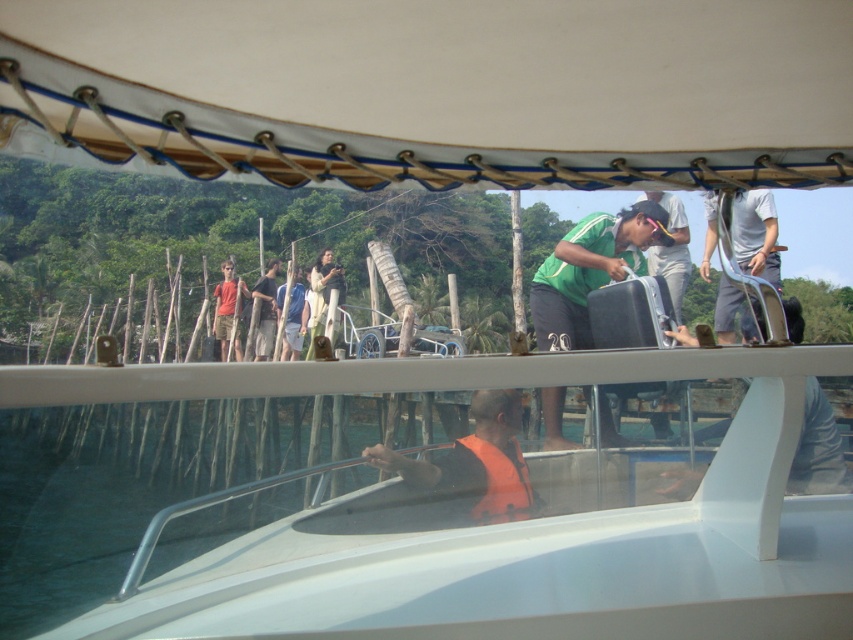
You are a tour guide on the boat and need to locate two tourists wearing green shirts. The first is wearing a green fabric shirt at center and the second a green matte shirt at upper center. Which tourist is positioned more to the right?

The green matte shirt at upper center is positioned more to the right than the green fabric shirt at center.

You are on a boat and need to hand a document to both the person in the green fabric shirt at center and the orange cotton shirt at left. Which person should you approach first based on their proximity to you?

You should approach the green fabric shirt at center first because they are closer to you than the orange cotton shirt at left.